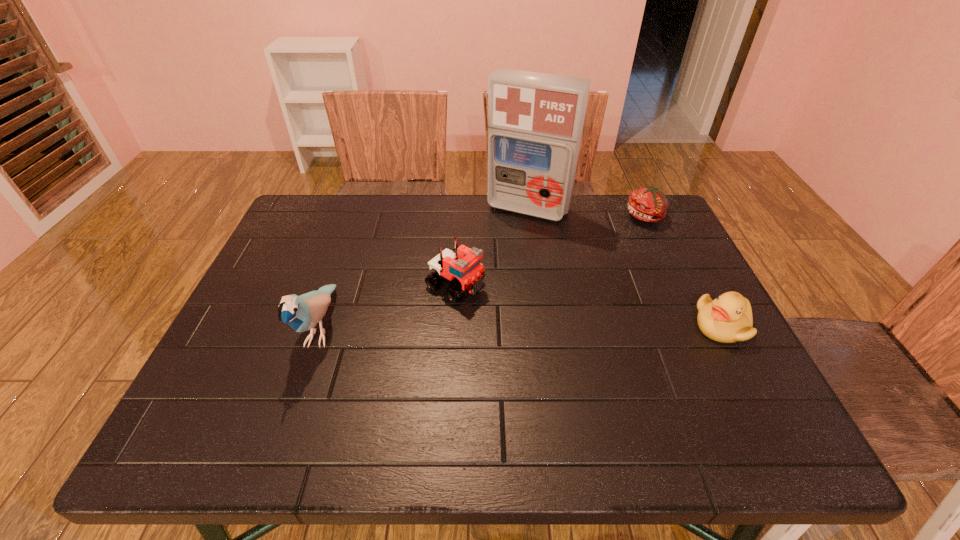
Image resolution: width=960 pixels, height=540 pixels. I want to click on unoccupied position between the duckling and the tomato, so click(684, 271).

Locate which object ranks second in proximity to the fourth shortest object. Please provide its 2D coordinates. Your answer should be formatted as a tuple, i.e. [(x, y)], where the tuple contains the x and y coordinates of a point satisfying the conditions above.

[(535, 120)]

Where is `the closest object relative to the duckling`? the closest object relative to the duckling is located at coordinates (648, 204).

You are a GUI agent. You are given a task and a screenshot of the screen. Output one action in this format:
    pyautogui.click(x=<x>, y=<y>)
    Task: Click on the vacant position in the image that satisfies the following two spatial constraints: 1. on the front side of the tallest object; 2. on the right side of the tomato
    The width and height of the screenshot is (960, 540).
    Given the screenshot: What is the action you would take?
    pyautogui.click(x=529, y=217)